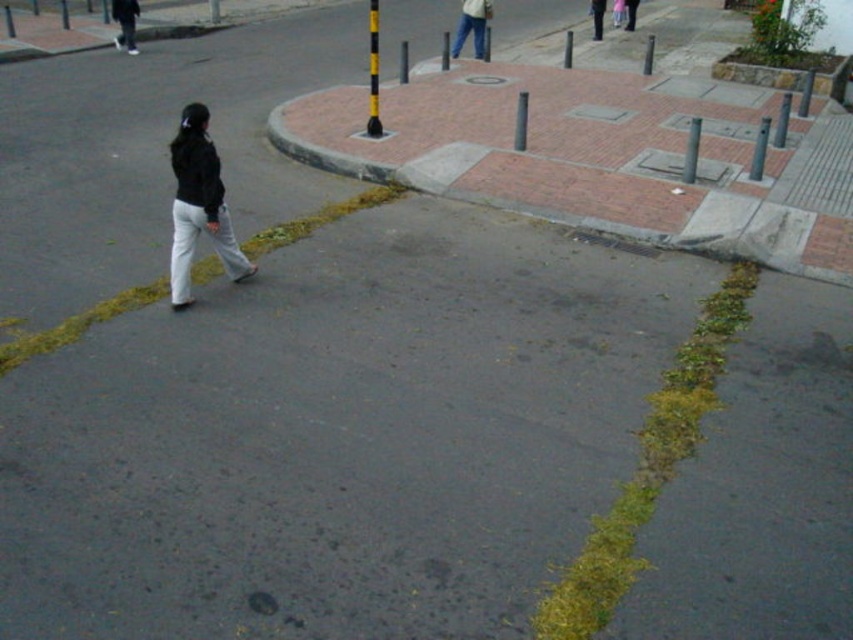
Does jeans at center appear under dark blue jeans at center?

Indeed, jeans at center is positioned under dark blue jeans at center.

Looking at this image, which of these two, jeans at center or dark blue jeans at center, stands taller?

jeans at center is taller.

Locate an element on the screen. jeans at center is located at coordinates (473, 26).

Who is taller, matte black jacket at left or black matte pants at lower left?

matte black jacket at left is taller.

Who is lower down, matte black jacket at left or black matte pants at lower left?

matte black jacket at left is lower down.

Which is behind, point (207, 224) or point (120, 44)?

The point (120, 44) is behind.

Image resolution: width=853 pixels, height=640 pixels. I want to click on matte black jacket at left, so click(198, 204).

Can you confirm if jeans at center is wider than black matte pants at lower left?

In fact, jeans at center might be narrower than black matte pants at lower left.

Between point (451, 52) and point (115, 4), which one is positioned in front?

Point (451, 52) is more forward.

You are a GUI agent. You are given a task and a screenshot of the screen. Output one action in this format:
    pyautogui.click(x=<x>, y=<y>)
    Task: Click on the jeans at center
    Image resolution: width=853 pixels, height=640 pixels.
    Given the screenshot: What is the action you would take?
    pyautogui.click(x=473, y=26)